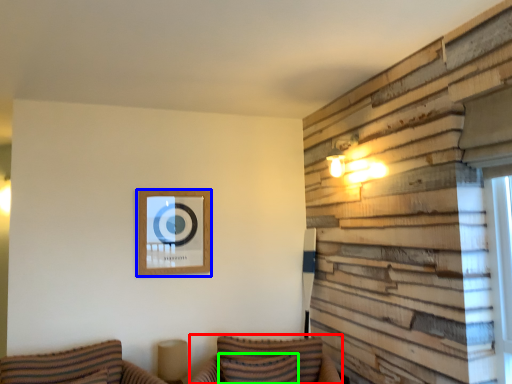
Question: Which is nearer to the couch (highlighted by a red box)? picture frame (highlighted by a blue box) or pillow (highlighted by a green box).

Choices:
 (A) picture frame
 (B) pillow

Answer: (B)